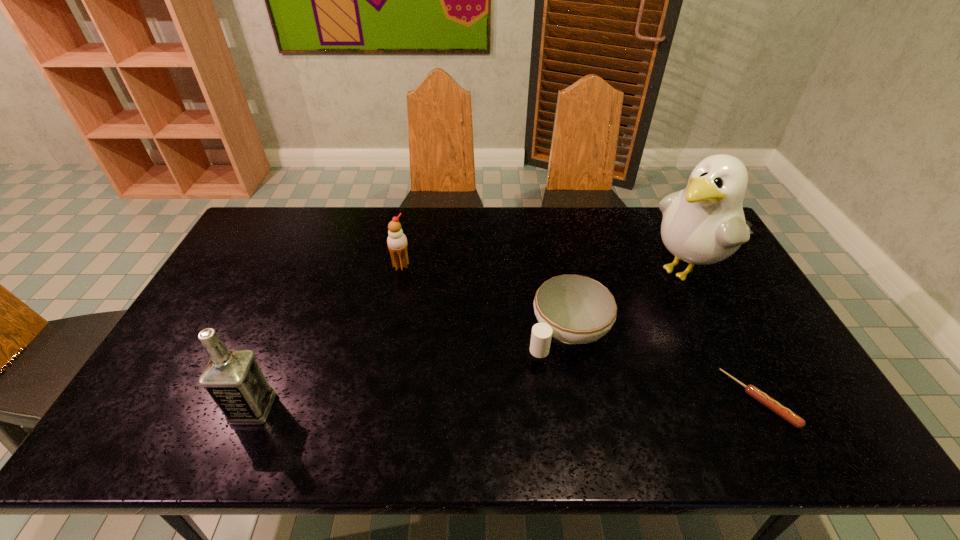
Identify the location of free location located 0.090m on the beak of the gull. The image size is (960, 540). (639, 300).

Where is `object that is at the far edge`? Image resolution: width=960 pixels, height=540 pixels. object that is at the far edge is located at coordinates (704, 223).

You are a GUI agent. You are given a task and a screenshot of the screen. Output one action in this format:
    pyautogui.click(x=<x>, y=<y>)
    Task: Click on the vodka located at the near edge
    The width and height of the screenshot is (960, 540).
    Given the screenshot: What is the action you would take?
    pyautogui.click(x=233, y=378)

At what (x,y) coordinates should I click in order to perform the action: click on sausage situated at the near edge. Please return your answer as a coordinate pair (x, y). This screenshot has width=960, height=540. Looking at the image, I should click on (760, 396).

Where is `sausage situated at the right edge`? sausage situated at the right edge is located at coordinates (760, 396).

The height and width of the screenshot is (540, 960). Find the location of `gull that is at the right edge`. gull that is at the right edge is located at coordinates (704, 223).

Where is `object that is at the far right corner`? The image size is (960, 540). object that is at the far right corner is located at coordinates (704, 223).

Where is `object that is at the near right corner`? Image resolution: width=960 pixels, height=540 pixels. object that is at the near right corner is located at coordinates (760, 396).

I want to click on blank space at the far edge of the desktop, so click(x=420, y=245).

Where is `free point at the near edge`? The image size is (960, 540). free point at the near edge is located at coordinates pos(661,402).